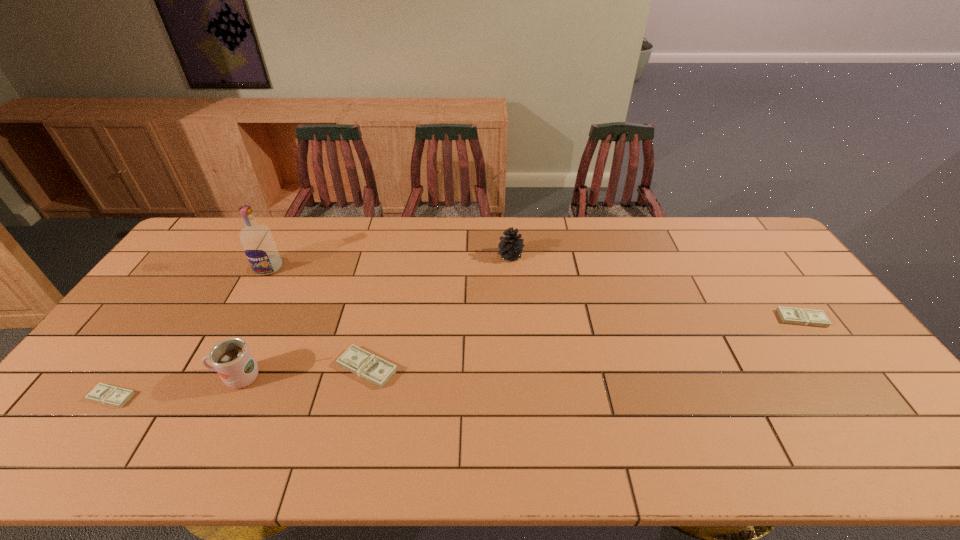
You are a GUI agent. You are given a task and a screenshot of the screen. Output one action in this format:
    pyautogui.click(x=<x>, y=<y>)
    Task: Click on the vacant area that satisfies the following two spatial constraints: 1. on the back side of the fourth object from left to right; 2. on the left side of the farthest money
    
    Given the screenshot: What is the action you would take?
    pyautogui.click(x=379, y=319)

This screenshot has width=960, height=540. I want to click on vacant point that satisfies the following two spatial constraints: 1. on the front side of the second money from right to left; 2. on the side with the handle of the cup, so click(365, 378).